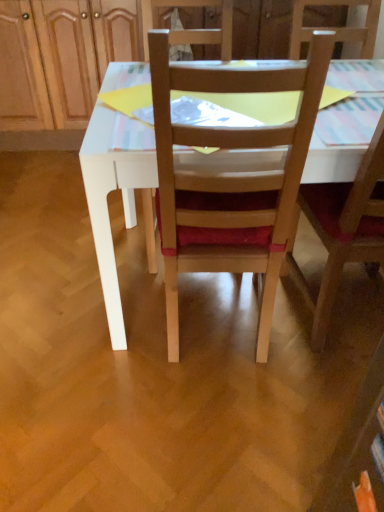
Question: Which direction should I rotate to look at wooden chair at center, acting as the first chair starting from the left, — up or down?

Choices:
 (A) down
 (B) up

Answer: (B)

Question: Is wooden chair at center, the 2th chair viewed from the right, directly adjacent to wooden chair at center, positioned as the 1th chair in right-to-left order?

Choices:
 (A) no
 (B) yes

Answer: (A)

Question: From a real-world perspective, is wooden chair at center, acting as the first chair starting from the left, positioned under wooden chair at center, the 2th chair from the left, based on gravity?

Choices:
 (A) no
 (B) yes

Answer: (B)

Question: From a real-world perspective, does wooden chair at center, the 2th chair viewed from the right, stand above wooden chair at center, positioned as the 1th chair in right-to-left order?

Choices:
 (A) no
 (B) yes

Answer: (A)

Question: From the image's perspective, does wooden chair at center, acting as the first chair starting from the left, appear higher than wooden chair at center, the 2th chair from the left?

Choices:
 (A) yes
 (B) no

Answer: (B)

Question: Does wooden chair at center, the 2th chair viewed from the right, appear on the left side of wooden chair at center, the 2th chair from the left?

Choices:
 (A) no
 (B) yes

Answer: (B)

Question: Does wooden chair at center, acting as the first chair starting from the left, come in front of wooden chair at center, positioned as the 1th chair in right-to-left order?

Choices:
 (A) yes
 (B) no

Answer: (A)

Question: Considering the relative positions of wooden chair at center, the 2th chair from the left, and wooden chair at center, acting as the first chair starting from the left, in the image provided, is wooden chair at center, the 2th chair from the left, to the right of wooden chair at center, acting as the first chair starting from the left, from the viewer's perspective?

Choices:
 (A) yes
 (B) no

Answer: (A)

Question: Can wooden chair at center, acting as the first chair starting from the left, be found inside wooden chair at center, positioned as the 1th chair in right-to-left order?

Choices:
 (A) no
 (B) yes

Answer: (A)

Question: From a real-world perspective, is wooden chair at center, positioned as the 1th chair in right-to-left order, over wooden chair at center, acting as the first chair starting from the left?

Choices:
 (A) no
 (B) yes

Answer: (B)

Question: Is the position of wooden chair at center, positioned as the 1th chair in right-to-left order, more distant than that of wooden chair at center, acting as the first chair starting from the left?

Choices:
 (A) no
 (B) yes

Answer: (B)

Question: Is wooden chair at center, the 2th chair from the left, completely or partially outside of wooden chair at center, the 2th chair viewed from the right?

Choices:
 (A) yes
 (B) no

Answer: (A)

Question: From the image's perspective, would you say wooden chair at center, the 2th chair from the left, is positioned over wooden chair at center, acting as the first chair starting from the left?

Choices:
 (A) yes
 (B) no

Answer: (A)

Question: From the image's perspective, does wooden dresser at upper center appear lower than wooden chair at center, positioned as the 1th chair in right-to-left order?

Choices:
 (A) yes
 (B) no

Answer: (B)